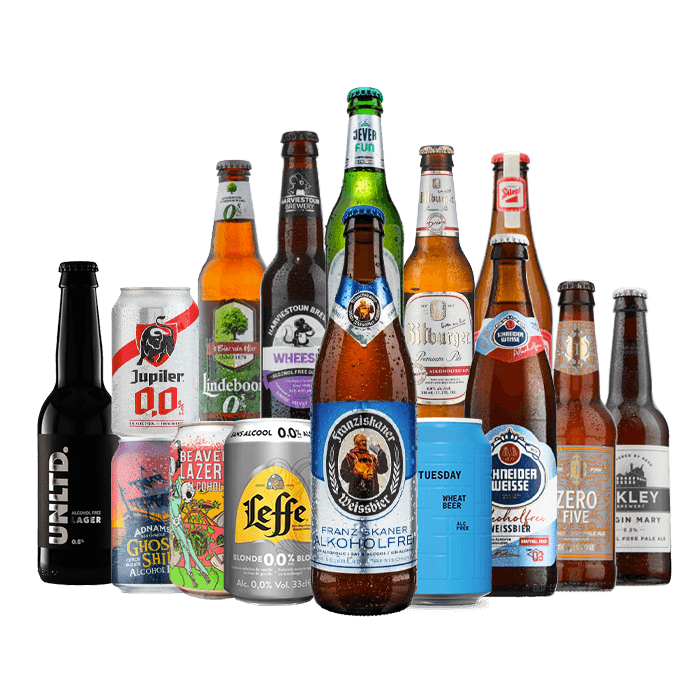
What are the coordinates of `bottles` in the screenshot? It's located at (71, 463), (230, 304), (287, 312), (356, 134), (434, 218), (510, 209), (505, 336), (580, 382), (638, 379), (368, 407).